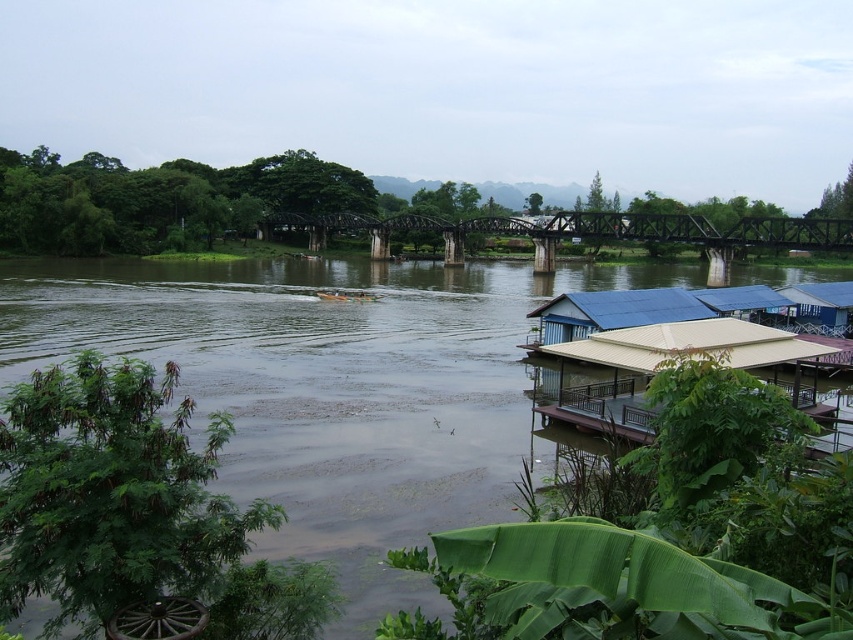
Question: Can you confirm if beige corrugated roof hut at lower right is positioned to the left of dark brown metal bridge at center?

Choices:
 (A) no
 (B) yes

Answer: (B)

Question: Which point is closer to the camera taking this photo?

Choices:
 (A) (328, 291)
 (B) (548, 305)
 (C) (380, 257)
 (D) (230, 401)

Answer: (D)

Question: Is dark brown metal bridge at center wider than green painted wood boat at center?

Choices:
 (A) no
 (B) yes

Answer: (B)

Question: Is blue corrugated metal hut at lower right positioned at the back of green painted wood boat at center?

Choices:
 (A) yes
 (B) no

Answer: (B)

Question: Which point is closer to the camera taking this photo?

Choices:
 (A) (297, 360)
 (B) (660, 228)
 (C) (703, 312)
 (D) (323, 292)

Answer: (A)

Question: Which point is closer to the camera?

Choices:
 (A) green painted wood boat at center
 (B) beige corrugated roof hut at lower right
 (C) blue corrugated metal hut at lower right
 (D) dark brown metal bridge at center

Answer: (B)